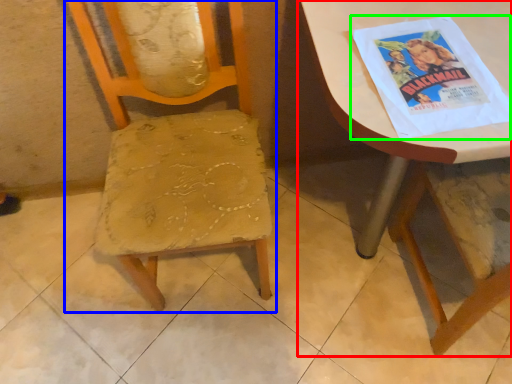
Question: Which object is the farthest from table (highlighted by a red box)? Choose among these: chair (highlighted by a blue box) or comic book (highlighted by a green box).

Choices:
 (A) chair
 (B) comic book

Answer: (A)